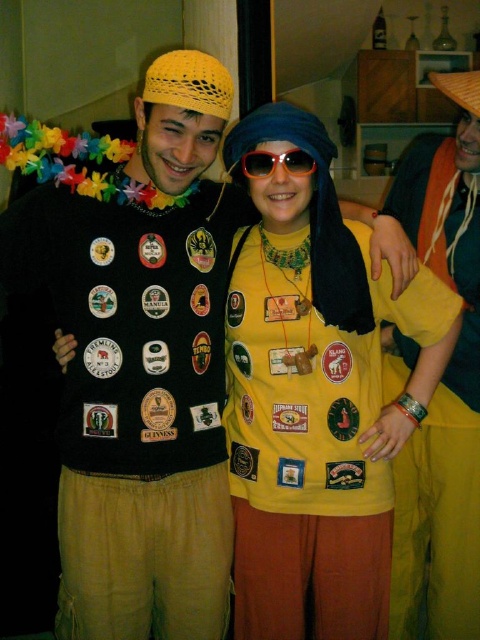
Based on the photo, you are at a festival and see two yellow items in the image. The yellow matte shirt at center and the yellow knitted hat at upper center. Which one is positioned to the right of the other?

The yellow matte shirt at center is to the right of the yellow knitted hat at upper center according to the description.